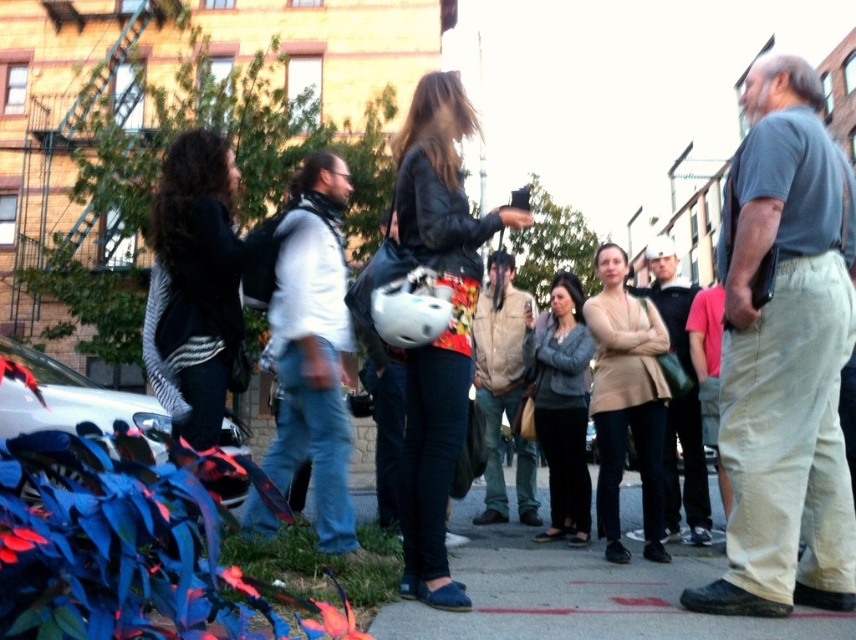
You are a pedestrian trying to cross the street and see the concrete sidewalk at center and the tan suede jacket at center. Which object is closer to you?

The concrete sidewalk at center is closer to you because it is in front of the tan suede jacket at center.

You are a delivery person trying to place a package on the concrete sidewalk at center without blocking the tan suede jacket at center. Can you fit the package there?

The concrete sidewalk at center occupies less space than the tan suede jacket at center, so placing the package might not be possible without overlapping the jacket.

What is the object located at the coordinates point (x=314, y=349) in the image?

The object at point (x=314, y=349) is the white matte vest at center.